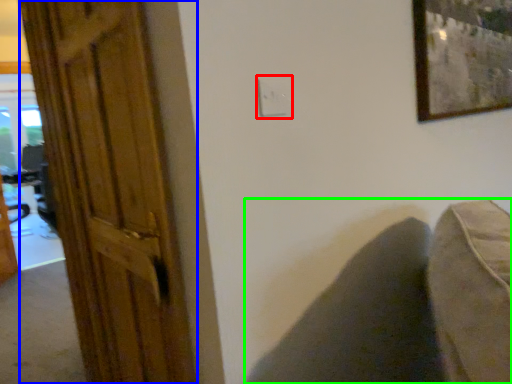
Question: Which object is the closest to the electric outlet (highlighted by a red box)? Choose among these: door (highlighted by a blue box) or swivel chair (highlighted by a green box).

Choices:
 (A) door
 (B) swivel chair

Answer: (B)